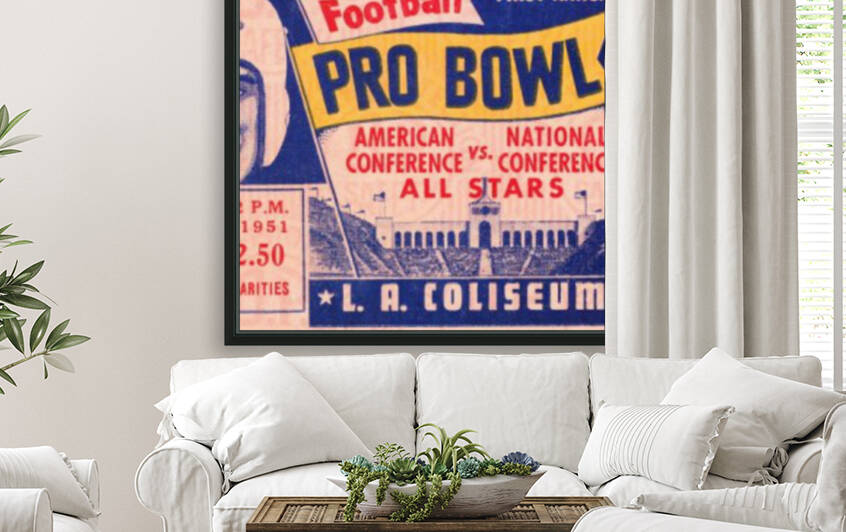
Find the location of a particular element. poster is located at coordinates (486, 147).